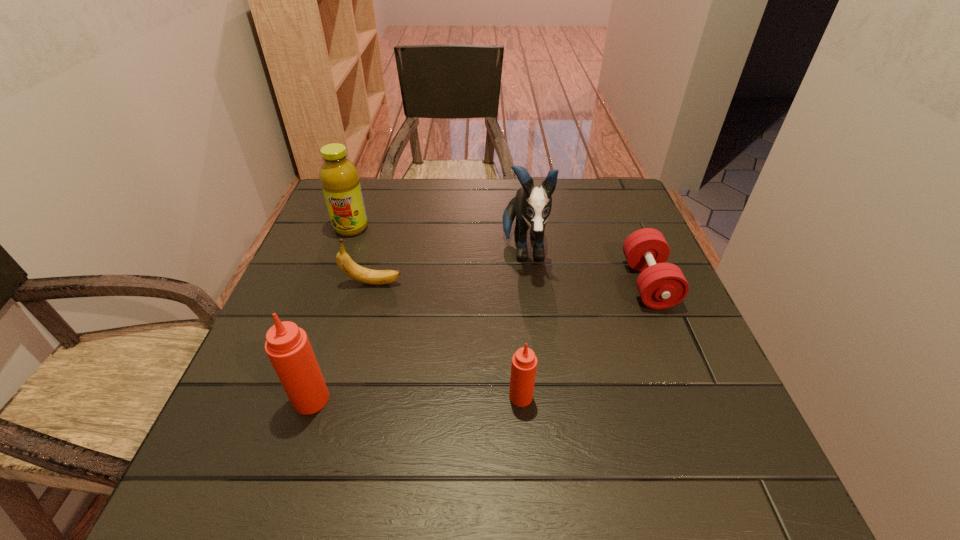
All Tabasco sauces are currently evenly spaced. To continue this pattern, where would you add another Tabasco sauce on the right? Please point out a vacant spot. Please provide its 2D coordinates. Your answer should be formatted as a tuple, i.e. [(x, y)], where the tuple contains the x and y coordinates of a point satisfying the conditions above.

[(729, 394)]